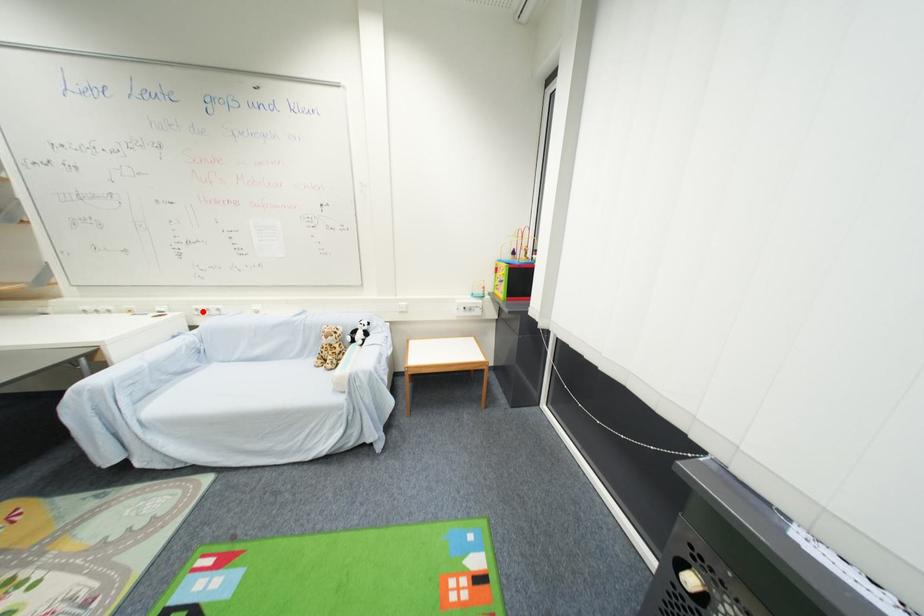
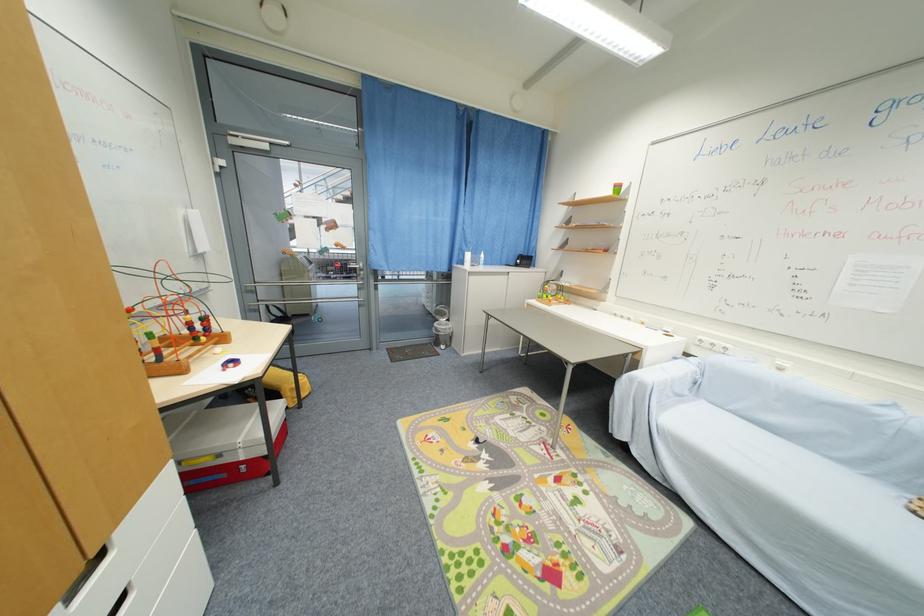
Where in the second image is the point corresponding to the highlighted location from the first image?

(706, 342)